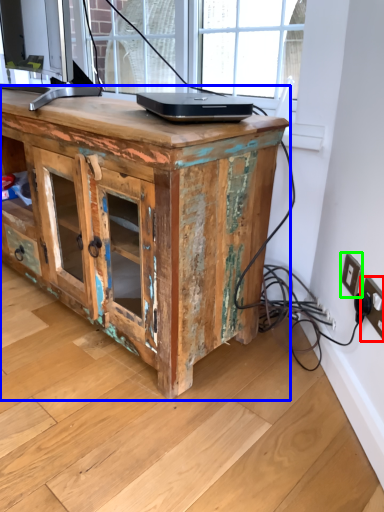
Question: Which is nearer to the electric outlet (highlighted by a red box)? desk (highlighted by a blue box) or electric outlet (highlighted by a green box).

Choices:
 (A) desk
 (B) electric outlet

Answer: (B)